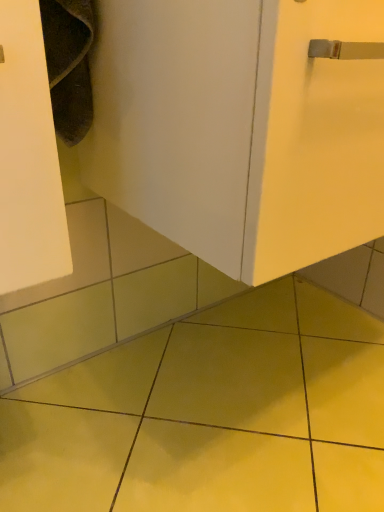
Question: Is white matte door at center to the right of yellow glossy tile at center from the viewer's perspective?

Choices:
 (A) no
 (B) yes

Answer: (B)

Question: Does white matte door at center have a larger size compared to yellow glossy tile at center?

Choices:
 (A) no
 (B) yes

Answer: (B)

Question: Is there a large distance between white matte door at center and yellow glossy tile at center?

Choices:
 (A) no
 (B) yes

Answer: (A)

Question: Can you confirm if white matte door at center is shorter than yellow glossy tile at center?

Choices:
 (A) yes
 (B) no

Answer: (B)

Question: Is white matte door at center in contact with yellow glossy tile at center?

Choices:
 (A) no
 (B) yes

Answer: (A)

Question: Considering the relative sizes of white matte door at center and yellow glossy tile at center in the image provided, is white matte door at center taller than yellow glossy tile at center?

Choices:
 (A) no
 (B) yes

Answer: (B)

Question: Is yellow glossy tile at center positioned beyond the bounds of white matte door at center?

Choices:
 (A) yes
 (B) no

Answer: (A)

Question: Considering the relative sizes of yellow glossy tile at center and white matte door at center in the image provided, is yellow glossy tile at center smaller than white matte door at center?

Choices:
 (A) yes
 (B) no

Answer: (A)

Question: From a real-world perspective, is yellow glossy tile at center positioned under white matte door at center based on gravity?

Choices:
 (A) no
 (B) yes

Answer: (B)

Question: From a real-world perspective, is yellow glossy tile at center on top of white matte door at center?

Choices:
 (A) no
 (B) yes

Answer: (A)

Question: Is white matte door at center at the back of yellow glossy tile at center?

Choices:
 (A) yes
 (B) no

Answer: (B)

Question: From the image's perspective, is yellow glossy tile at center located above white matte door at center?

Choices:
 (A) no
 (B) yes

Answer: (A)

Question: Based on their positions, is yellow glossy tile at center located to the left or right of white matte door at center?

Choices:
 (A) right
 (B) left

Answer: (B)